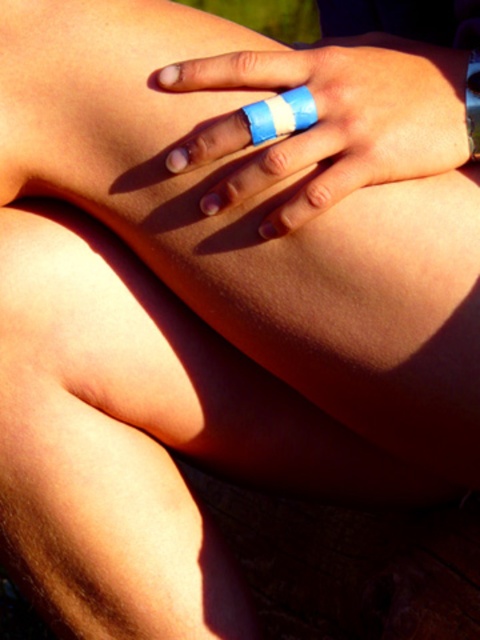
Describe the element at coordinates (342, 118) in the screenshot. The width and height of the screenshot is (480, 640). I see `blue striped bandage at center` at that location.

Is blue striped bandage at center positioned before blue tape at center?

That is True.

Between point (233, 83) and point (476, 72), which one is positioned in front?

Point (233, 83) is in front.

Locate an element on the screen. The height and width of the screenshot is (640, 480). blue striped bandage at center is located at coordinates (342, 118).

Can you confirm if blue tape bandage at center is positioned to the right of blue tape at center?

Incorrect, blue tape bandage at center is not on the right side of blue tape at center.

Between blue tape bandage at center and blue tape at center, which one has more height?

Standing taller between the two is blue tape at center.

Where is `blue tape bandage at center`? This screenshot has height=640, width=480. blue tape bandage at center is located at coordinates (280, 115).

Which is in front, point (315, 188) or point (278, 109)?

Point (315, 188)

Can you confirm if blue striped bandage at center is thinner than blue tape bandage at center?

No.

In order to click on blue striped bandage at center in this screenshot , I will do `click(342, 118)`.